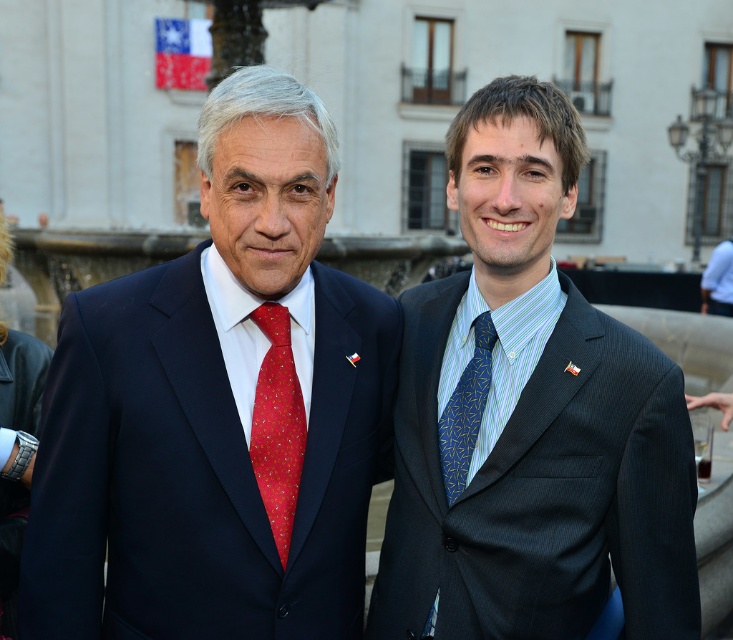
Question: Is blue pinstripe suit at right to the left of red silk tie at center from the viewer's perspective?

Choices:
 (A) yes
 (B) no

Answer: (B)

Question: Which object is positioned farthest from the blue silk tie at right?

Choices:
 (A) blue textured tie at right
 (B) matte black suit at left
 (C) red silk tie at center

Answer: (B)

Question: Can you confirm if blue pinstripe suit at right is positioned to the left of red silk tie at center?

Choices:
 (A) no
 (B) yes

Answer: (A)

Question: Does matte black suit at left lie behind blue pinstripe suit at right?

Choices:
 (A) no
 (B) yes

Answer: (B)

Question: Based on their relative distances, which object is farther from the red silk tie at center?

Choices:
 (A) matte black suit at left
 (B) blue pinstripe suit at right
 (C) blue textured tie at right
 (D) blue silk tie at right

Answer: (B)

Question: Which point is closer to the camera?

Choices:
 (A) blue silk tie at right
 (B) matte black suit at left

Answer: (B)